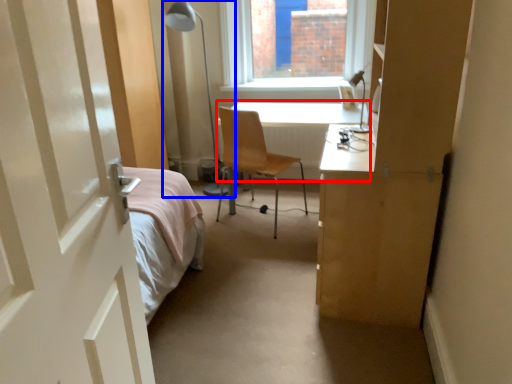
Question: Which object appears farthest to the camera in this image, table (highlighted by a red box) or table lamp (highlighted by a blue box)?

Choices:
 (A) table
 (B) table lamp

Answer: (A)